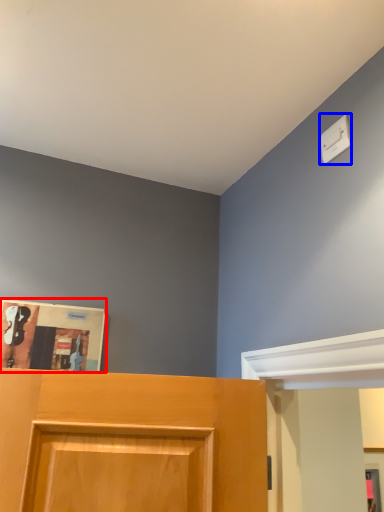
Question: Which object appears farthest to the camera in this image, magazine (highlighted by a red box) or light switch (highlighted by a blue box)?

Choices:
 (A) magazine
 (B) light switch

Answer: (A)